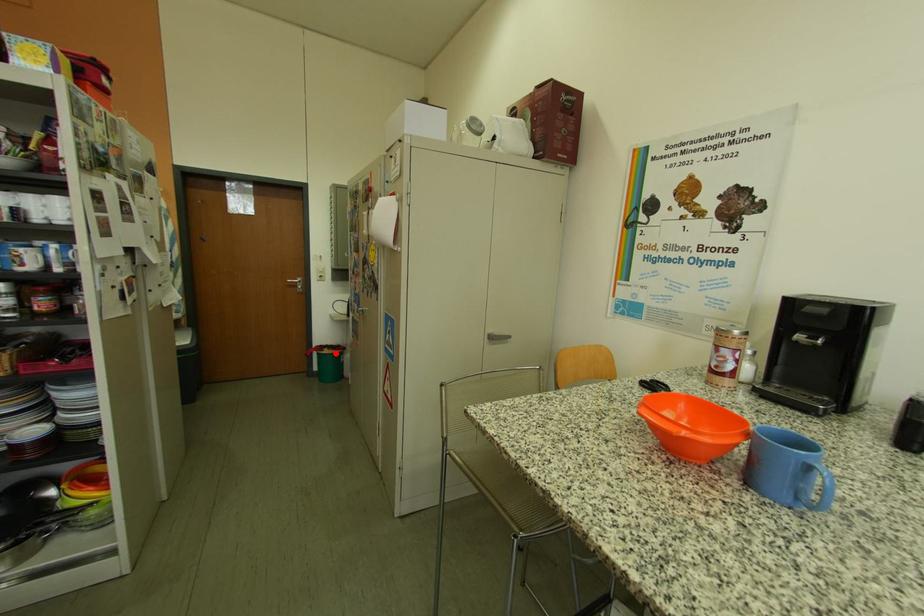
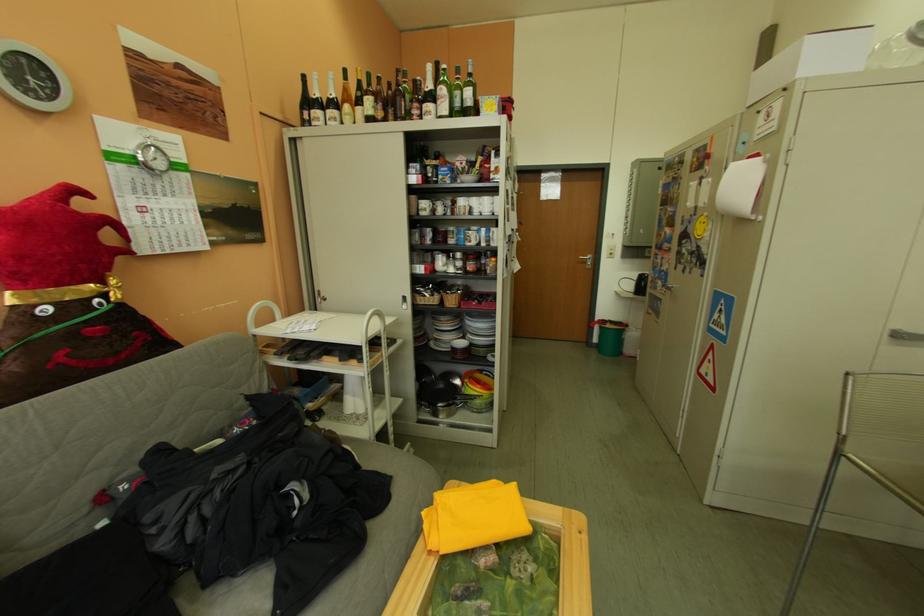
Find the pixel in the second image that matches the highlighted location in the first image.

(617, 326)